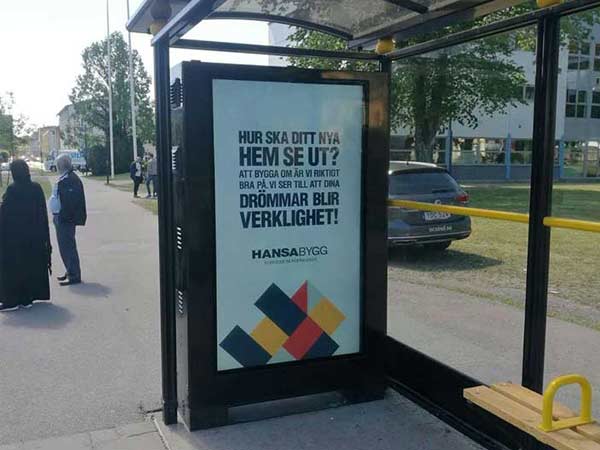
What are the coordinates of `handle` in the screenshot? It's located at (570, 379).